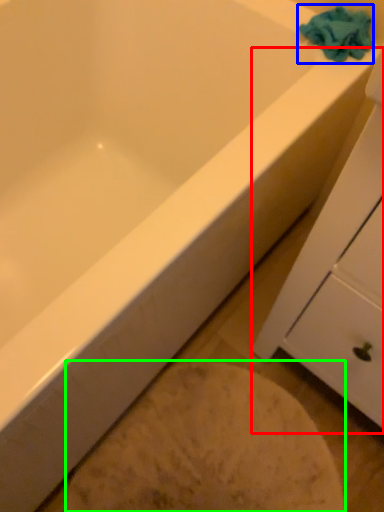
Question: Estimate the real-world distances between objects in this image. Which object is closer to cabinetry (highlighted by a red box), bath towel (highlighted by a blue box) or porcelain (highlighted by a green box)?

Choices:
 (A) bath towel
 (B) porcelain

Answer: (B)